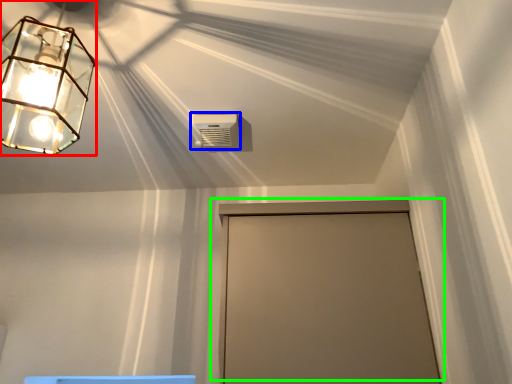
Question: Which is nearer to the lamp (highlighted by a red box)? air conditioning (highlighted by a blue box) or door (highlighted by a green box).

Choices:
 (A) air conditioning
 (B) door

Answer: (A)